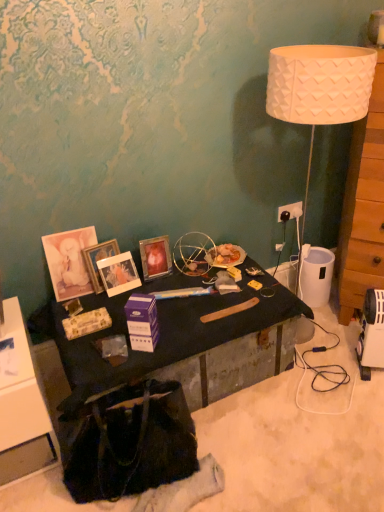
Locate an element on the screen. vacant space to the left of purple cardboard box at center is located at coordinates (104, 350).